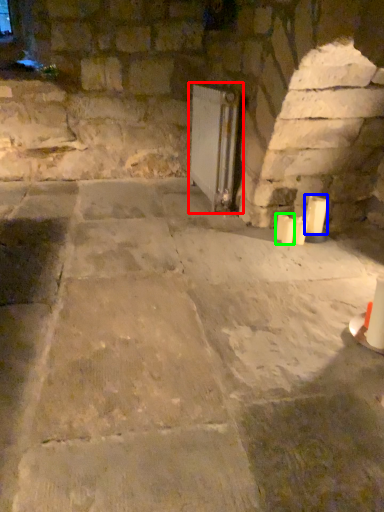
Question: Which object is the closest to the fireplace (highlighted by a red box)? Choose among these: candle (highlighted by a blue box) or candle (highlighted by a green box).

Choices:
 (A) candle
 (B) candle

Answer: (B)